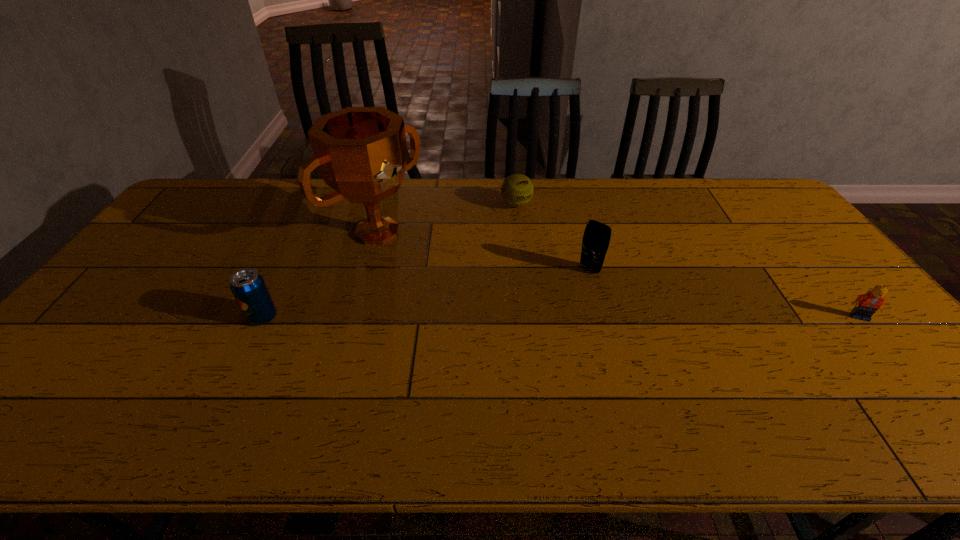
Locate an element on the screen. award situated at the far edge is located at coordinates (361, 153).

This screenshot has height=540, width=960. I want to click on object located at the right edge, so click(866, 305).

At what (x,y) coordinates should I click in order to perform the action: click on free space at the far edge of the desktop. Please return your answer as a coordinate pair (x, y). Image resolution: width=960 pixels, height=540 pixels. Looking at the image, I should click on (681, 186).

Identify the location of vacant space at the near edge. (341, 374).

This screenshot has width=960, height=540. I want to click on vacant space at the left edge of the desktop, so click(x=112, y=303).

Where is `vacant space at the far right corner`? vacant space at the far right corner is located at coordinates (750, 180).

You are a GUI agent. You are given a task and a screenshot of the screen. Output one action in this format:
    pyautogui.click(x=<x>, y=<y>)
    Task: Click on the vacant area that lies between the award and the second object from right to left
    This screenshot has height=540, width=960.
    Given the screenshot: What is the action you would take?
    (x=484, y=251)

In order to click on empty space between the tallest object and the softball in this screenshot , I will do `click(446, 218)`.

You are a GUI agent. You are given a task and a screenshot of the screen. Output one action in this format:
    pyautogui.click(x=<x>, y=<y>)
    Task: Click on the vacant space in between the tallest object and the second object from right to left
    This screenshot has height=540, width=960.
    Given the screenshot: What is the action you would take?
    pos(484,251)

Where is `free spot between the rightmost object and the softball`? free spot between the rightmost object and the softball is located at coordinates (687, 260).